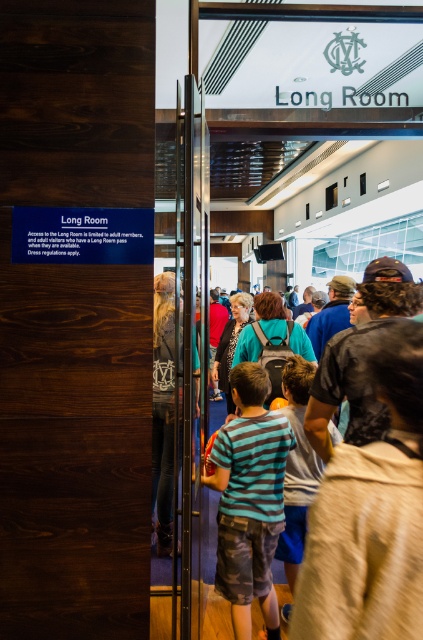
In the scene shown: Does striped cotton shirt at center have a smaller size compared to denim jeans at center?

Yes.

Is striped cotton shirt at center taller than denim jeans at center?

No, striped cotton shirt at center is not taller than denim jeans at center.

Which is in front, point (373, 506) or point (164, 477)?

Point (373, 506)

Locate an element on the screen. striped cotton shirt at center is located at coordinates (370, 516).

Which is more to the left, denim jeans at center or matte blue backpack at center?

From the viewer's perspective, denim jeans at center appears more on the left side.

Which is in front, point (156, 458) or point (247, 337)?

Point (247, 337) is in front.

Find the location of `denim jeans at center`. denim jeans at center is located at coordinates (162, 410).

Does striped cotton shirt at center appear on the left side of teal fabric jacket at center?

Incorrect, striped cotton shirt at center is not on the left side of teal fabric jacket at center.

Does striped cotton shirt at center have a greater width compared to teal fabric jacket at center?

No, striped cotton shirt at center is not wider than teal fabric jacket at center.

What are the coordinates of `striped cotton shirt at center` in the screenshot? It's located at (370, 516).

You are a GUI agent. You are given a task and a screenshot of the screen. Output one action in this format:
    pyautogui.click(x=<x>, y=<y>)
    Task: Click on the striped cotton shirt at center
    The image size is (423, 640).
    Given the screenshot: What is the action you would take?
    pyautogui.click(x=370, y=516)